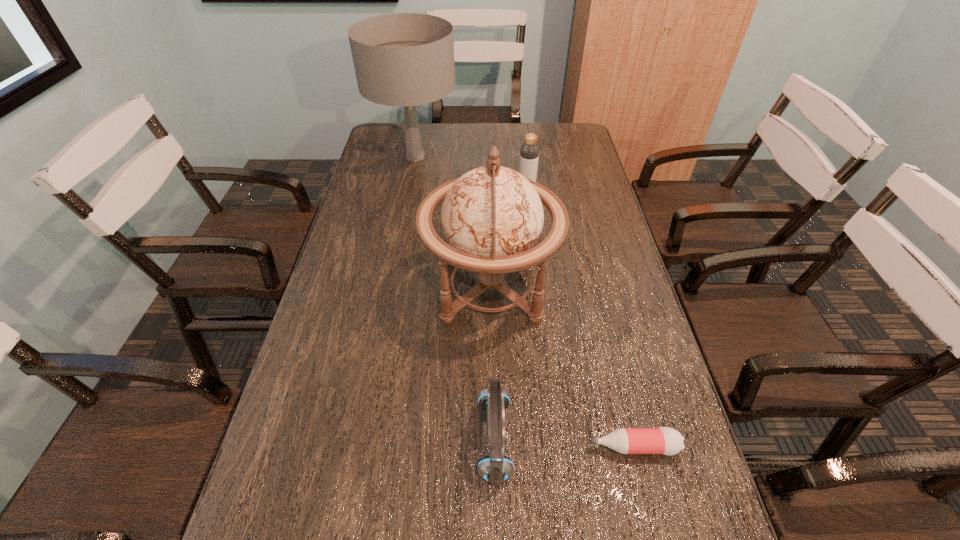
This screenshot has width=960, height=540. Find the location of `free spot located on the front-facing side of the third farthest object`. free spot located on the front-facing side of the third farthest object is located at coordinates (359, 288).

The width and height of the screenshot is (960, 540). Identify the location of free space located on the left of the left bottle. (426, 193).

Locate an element on the screen. This screenshot has height=540, width=960. free space located 0.390m on the ear cups of the headset is located at coordinates (288, 440).

In order to click on vacant space located 0.210m on the ear cups of the headset in this screenshot , I will do `click(375, 440)`.

You are a GUI agent. You are given a task and a screenshot of the screen. Output one action in this format:
    pyautogui.click(x=<x>, y=<y>)
    Task: Click on the free region located on the ear cups of the headset
    This screenshot has height=540, width=960.
    Given the screenshot: What is the action you would take?
    pyautogui.click(x=444, y=440)

Identify the location of vacant point located with the cap open on the shortest object. (431, 447).

Where is `vacant space positioned 0.210m with the cap open on the shortest object`? vacant space positioned 0.210m with the cap open on the shortest object is located at coordinates (485, 447).

Locate an element on the screen. vacant space located 0.270m with the cap open on the shortest object is located at coordinates (456, 447).

This screenshot has height=540, width=960. Identify the location of object located at the far edge. (403, 59).

You are a GUI agent. You are given a task and a screenshot of the screen. Output one action in this format:
    pyautogui.click(x=<x>, y=<y>)
    Task: Click on the object that is at the left edge
    
    Given the screenshot: What is the action you would take?
    pyautogui.click(x=403, y=59)